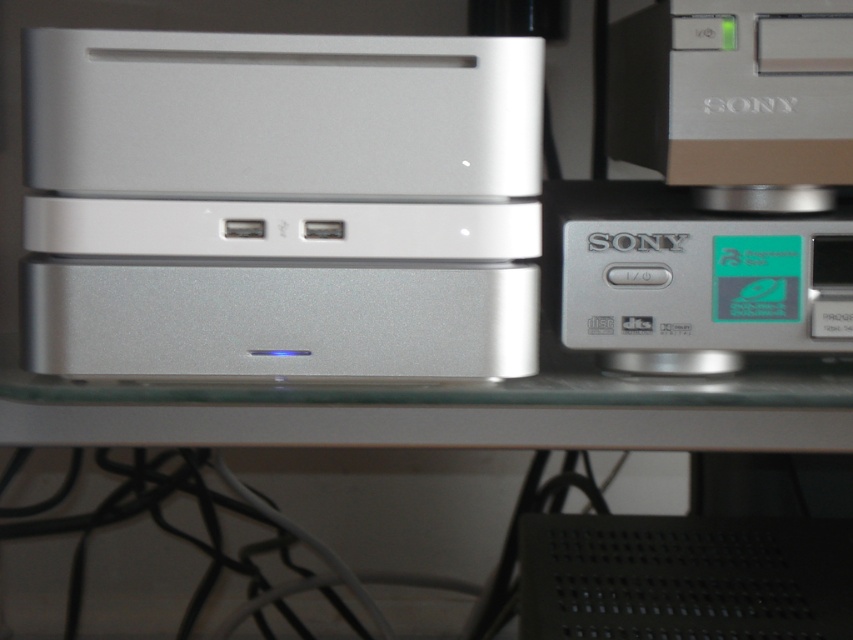
You are a technician who needs to reach the satin silver computer at center to perform maintenance. Your arm can extend 22 inches. Can you reach it?

The satin silver computer at center is 22.66 inches from viewer, so your arm can only extend 22 inches, meaning you cannot reach it without moving closer.

You are setting up a home theater system and need to place the satin silver computer at center and the satin silver speaker at center on a shelf. Since the shelf has limited vertical space, which device should you place first to ensure both fit properly?

The satin silver speaker at center should be placed first because it is shorter than the satin silver computer at center. By placing the shorter speaker first, there will be enough vertical space remaining to accommodate the taller computer afterward.